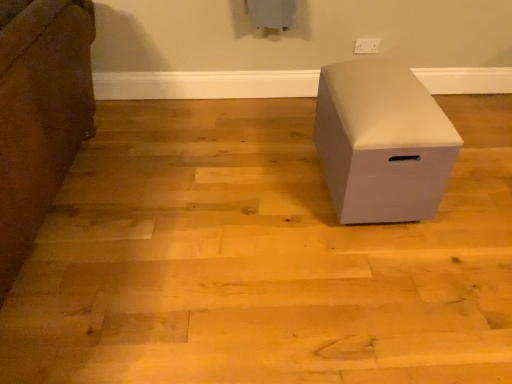
I want to click on vacant area on top of white matte storage box at center, positioned as the first furniture in right-to-left order (from a real-world perspective), so click(379, 77).